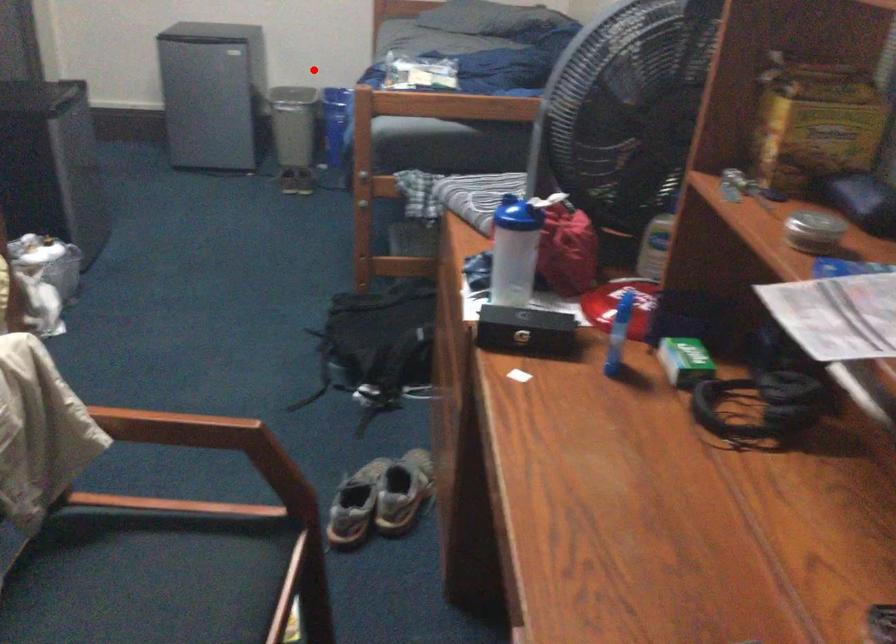
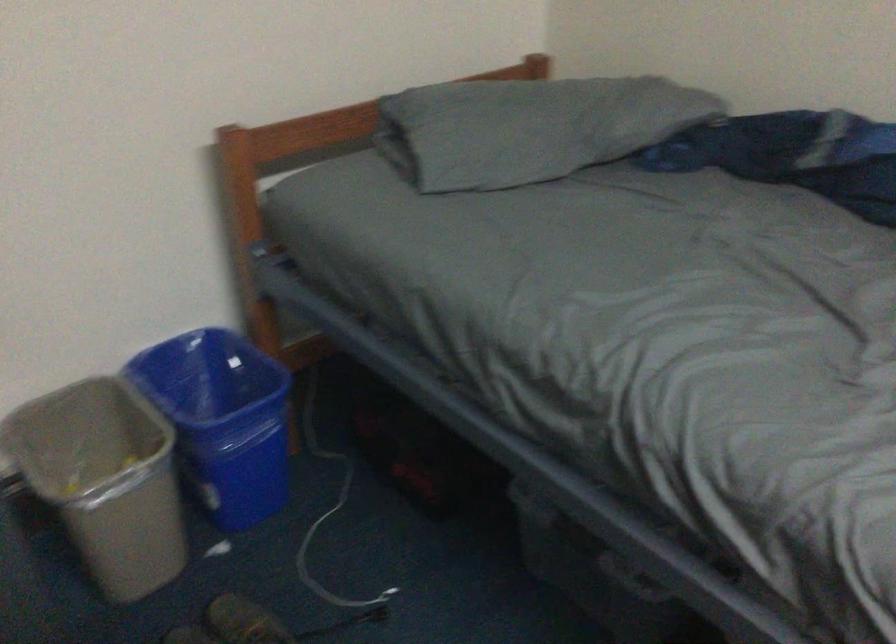
Question: I am providing you with two images of the same scene from different viewpoints. In image1, a red point is highlighted. Considering the same 3D point in image2, which of the following is correct?

Choices:
 (A) It is closer
 (B) It is farther

Answer: (A)